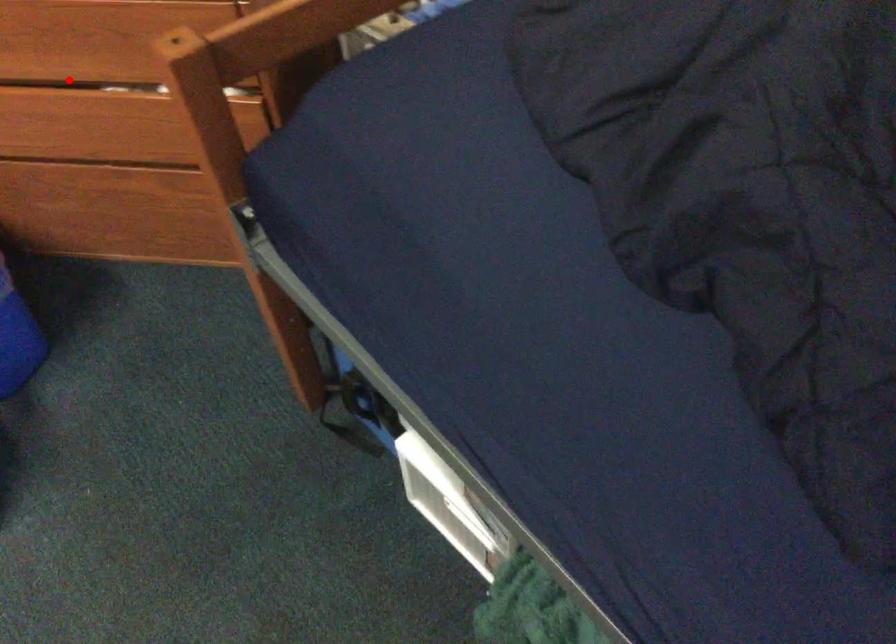
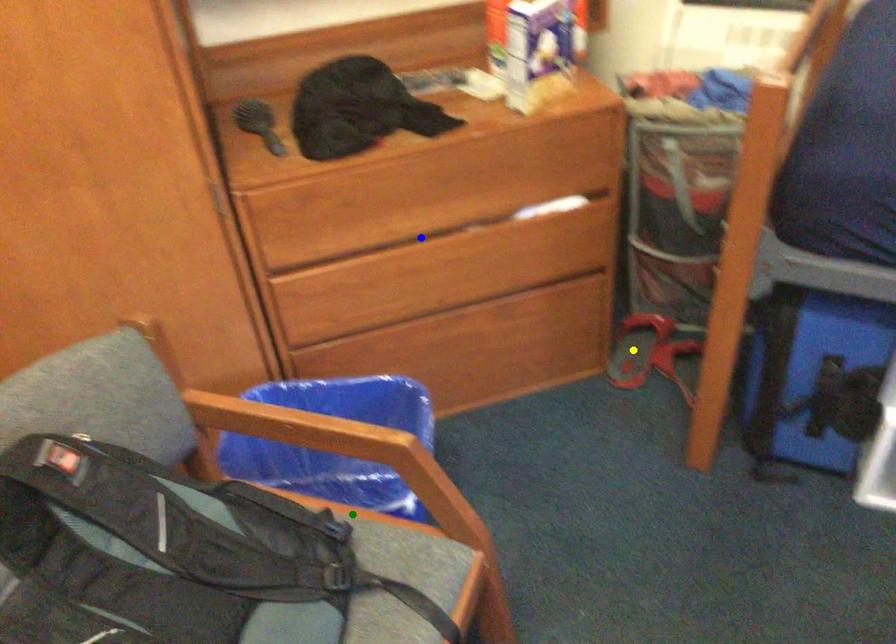
Question: I am providing you with two images of the same scene from different viewpoints. A red point is marked on the first image. You are given multiple points on the second image. Which point in image 2 is actually the same real-world point as the red point in image 1?

Choices:
 (A) green point
 (B) yellow point
 (C) blue point

Answer: (C)